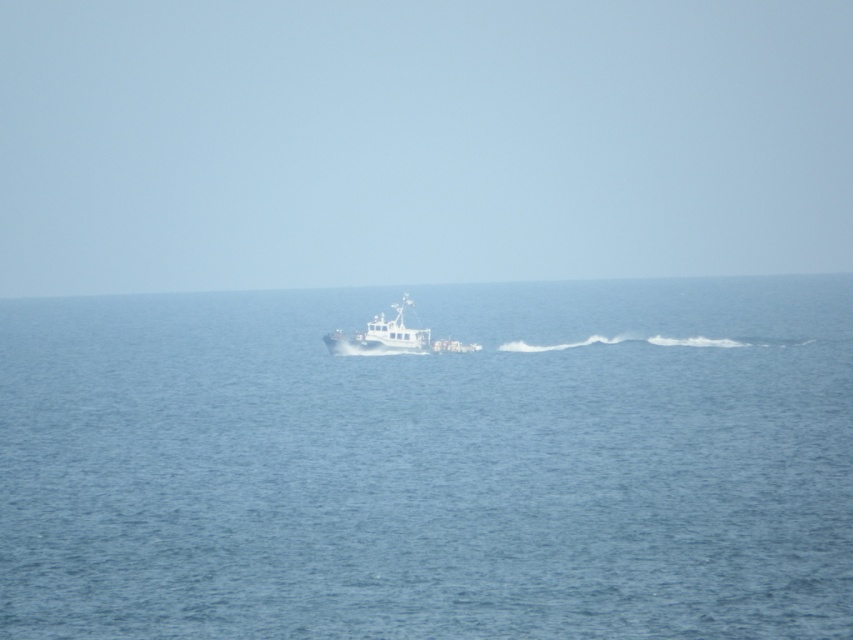
Can you confirm if blue water at center is positioned below white matte boat at center?

Actually, blue water at center is above white matte boat at center.

From the picture: Can you confirm if blue water at center is taller than white matte boat at center?

Yes, blue water at center is taller than white matte boat at center.

Between point (705, 305) and point (369, 330), which one is positioned in front?

Point (369, 330)

You are a GUI agent. You are given a task and a screenshot of the screen. Output one action in this format:
    pyautogui.click(x=<x>, y=<y>)
    Task: Click on the blue water at center
    This screenshot has height=640, width=853.
    Given the screenshot: What is the action you would take?
    pos(431,465)